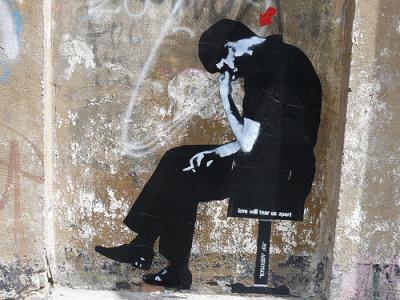
Locate an element on the screen. wall is located at coordinates (104, 140), (363, 108).